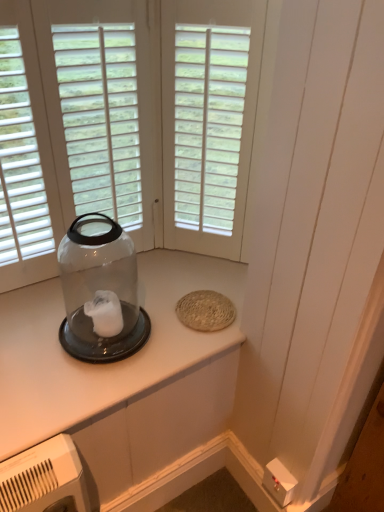
Question: Is clear plastic jar at upper left to the left of transparent glass jar at left from the viewer's perspective?

Choices:
 (A) no
 (B) yes

Answer: (A)

Question: From the image's perspective, would you say clear plastic jar at upper left is shown under transparent glass jar at left?

Choices:
 (A) yes
 (B) no

Answer: (A)

Question: From a real-world perspective, is clear plastic jar at upper left positioned over transparent glass jar at left based on gravity?

Choices:
 (A) yes
 (B) no

Answer: (B)

Question: Is clear plastic jar at upper left oriented away from transparent glass jar at left?

Choices:
 (A) yes
 (B) no

Answer: (B)

Question: Does clear plastic jar at upper left have a smaller size compared to transparent glass jar at left?

Choices:
 (A) yes
 (B) no

Answer: (A)

Question: Can you confirm if clear plastic jar at upper left is thinner than transparent glass jar at left?

Choices:
 (A) no
 (B) yes

Answer: (A)

Question: Is transparent glass jar at left touching white matte window at center?

Choices:
 (A) yes
 (B) no

Answer: (B)

Question: Is transparent glass jar at left to the right of white matte window at center from the viewer's perspective?

Choices:
 (A) no
 (B) yes

Answer: (A)

Question: Is transparent glass jar at left closer to the viewer compared to white matte window at center?

Choices:
 (A) yes
 (B) no

Answer: (A)

Question: Is transparent glass jar at left facing towards white matte window at center?

Choices:
 (A) yes
 (B) no

Answer: (B)

Question: Does transparent glass jar at left have a larger size compared to white matte window at center?

Choices:
 (A) yes
 (B) no

Answer: (A)

Question: Can you confirm if transparent glass jar at left is taller than white matte window at center?

Choices:
 (A) yes
 (B) no

Answer: (B)

Question: Can you confirm if transparent glass jar at left is taller than clear plastic jar at upper left?

Choices:
 (A) yes
 (B) no

Answer: (A)